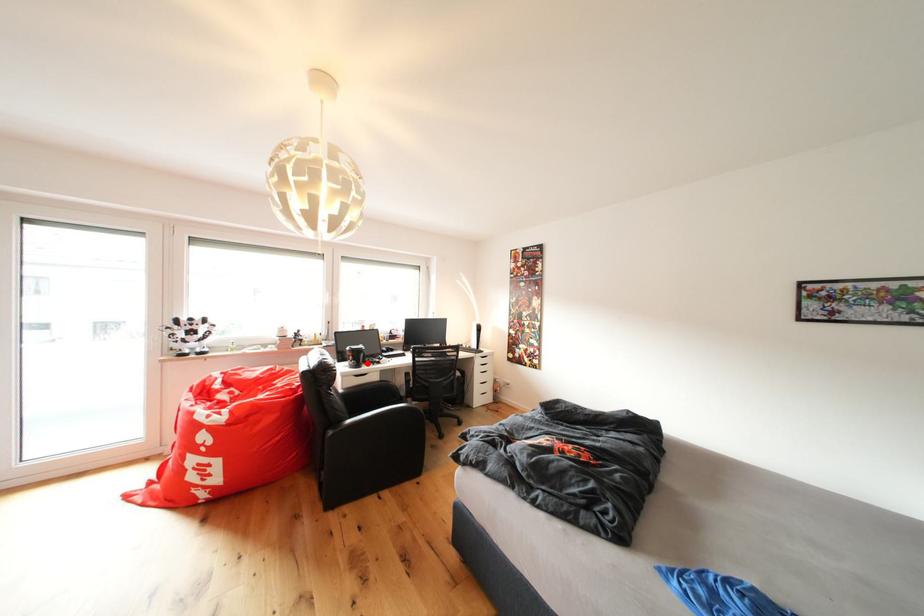
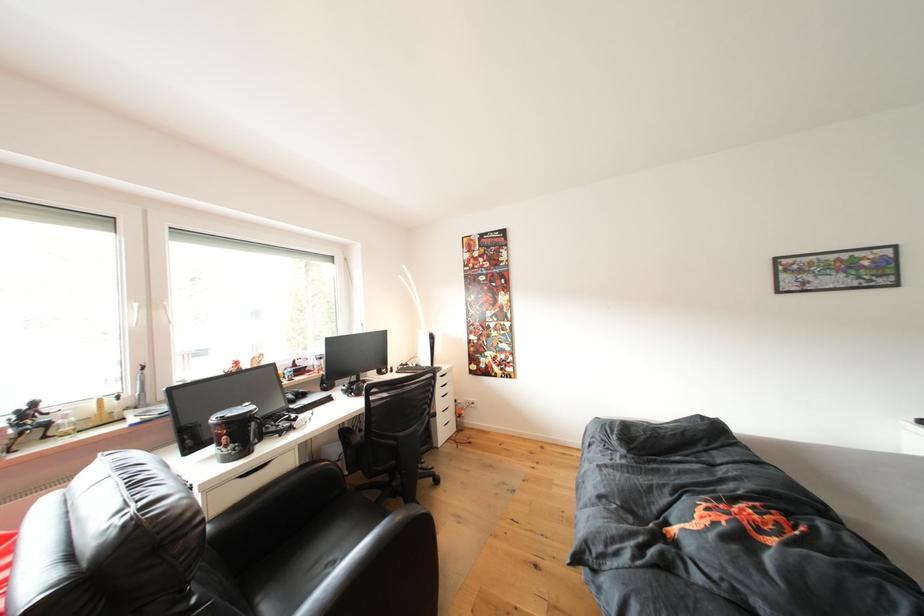
Where in the second image is the point corresponding to the highlighted location from the first image?

(253, 440)